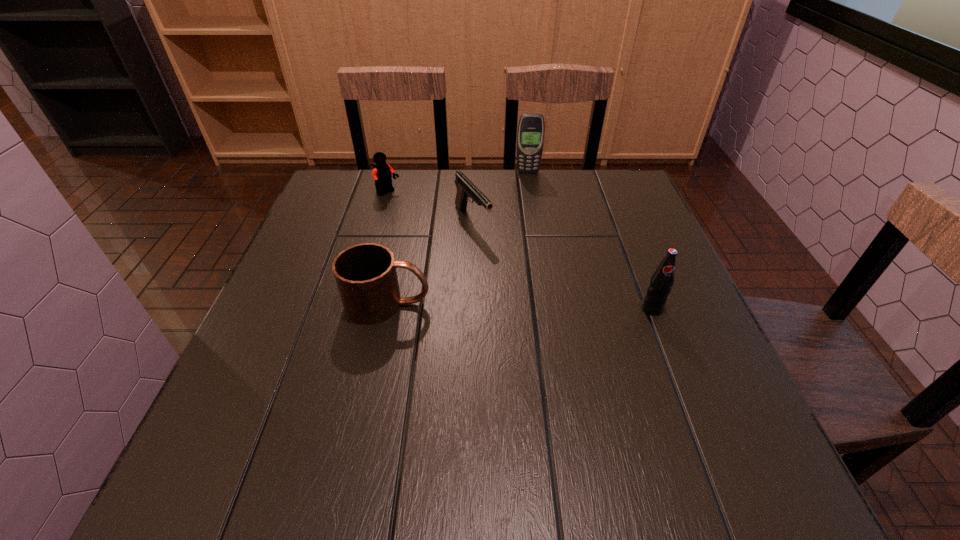
What are the coordinates of `pistol that is positioned at the far edge` in the screenshot? It's located at (465, 188).

The image size is (960, 540). I want to click on cellular telephone that is at the far edge, so click(x=530, y=136).

Find the location of a particular element. This screenshot has width=960, height=540. object situated at the left edge is located at coordinates (382, 172).

At what (x,y) coordinates should I click in order to perform the action: click on object located at the right edge. Please return your answer as a coordinate pair (x, y). The width and height of the screenshot is (960, 540). Looking at the image, I should click on (661, 281).

Identify the location of object at the far left corner. Image resolution: width=960 pixels, height=540 pixels. (382, 172).

Identify the location of free space at the far edge of the desktop. The image size is (960, 540). (492, 184).

Locate an element on the screen. Image resolution: width=960 pixels, height=540 pixels. vacant area at the near edge of the desktop is located at coordinates (636, 416).

In order to click on blank area at the left edge in this screenshot , I will do `click(281, 333)`.

In the image, there is a desktop. In order to click on vacant space at the right edge in this screenshot , I will do `click(649, 345)`.

In the image, there is a desktop. Identify the location of blank space at the far left corner. The width and height of the screenshot is (960, 540). (371, 173).